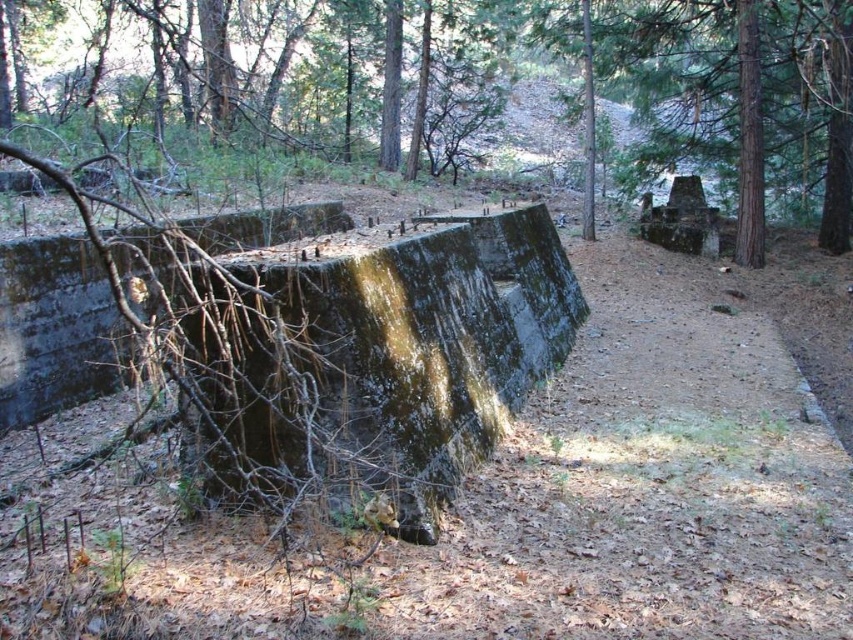
Question: Does green mossy concrete at center have a greater width compared to green mossy concrete wall at center?

Choices:
 (A) no
 (B) yes

Answer: (A)

Question: Is the position of green mossy concrete at center more distant than that of green mossy concrete wall at center?

Choices:
 (A) yes
 (B) no

Answer: (B)

Question: Which object appears farthest from the camera in this image?

Choices:
 (A) green mossy concrete at center
 (B) green mossy concrete wall at center

Answer: (B)

Question: Which object appears farthest from the camera in this image?

Choices:
 (A) green mossy concrete at center
 (B) green mossy concrete wall at center

Answer: (B)

Question: From the image, what is the correct spatial relationship of green mossy concrete at center in relation to green mossy concrete wall at center?

Choices:
 (A) below
 (B) above

Answer: (A)